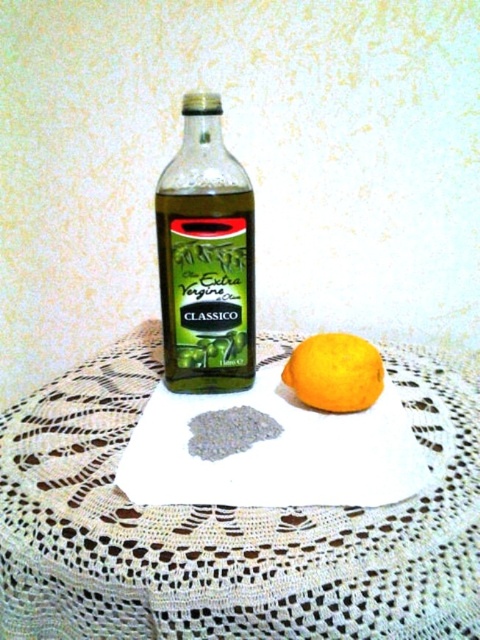
Can you confirm if white lace doily at center is taller than orange matte at center?

Yes.

Is white lace doily at center wider than orange matte at center?

Indeed, white lace doily at center has a greater width compared to orange matte at center.

Does point (22, 540) come closer to viewer compared to point (316, 374)?

Yes.

Where is `white lace doily at center`? Image resolution: width=480 pixels, height=640 pixels. white lace doily at center is located at coordinates (228, 528).

Does point (348, 525) lie in front of point (189, 93)?

That is True.

Consider the image. Does white lace doily at center have a lesser width compared to green glass bottle at center?

In fact, white lace doily at center might be wider than green glass bottle at center.

Which is in front, point (470, 502) or point (205, 376)?

Point (470, 502) is in front.

Where is `white lace doily at center`? white lace doily at center is located at coordinates (228, 528).

Does green glass bottle at center come behind orange matte at center?

Yes, it is behind orange matte at center.

Is green glass bottle at center thinner than orange matte at center?

No, green glass bottle at center is not thinner than orange matte at center.

Image resolution: width=480 pixels, height=640 pixels. What do you see at coordinates (205, 257) in the screenshot?
I see `green glass bottle at center` at bounding box center [205, 257].

This screenshot has width=480, height=640. What are the coordinates of `green glass bottle at center` in the screenshot? It's located at (205, 257).